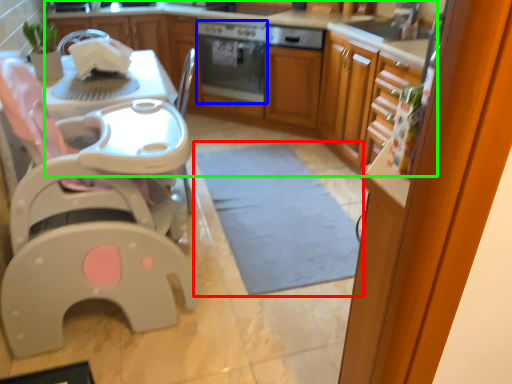
Question: Which object is the farthest from mat (highlighted by a red box)? Choose among these: home appliance (highlighted by a blue box) or cabinetry (highlighted by a green box).

Choices:
 (A) home appliance
 (B) cabinetry

Answer: (A)